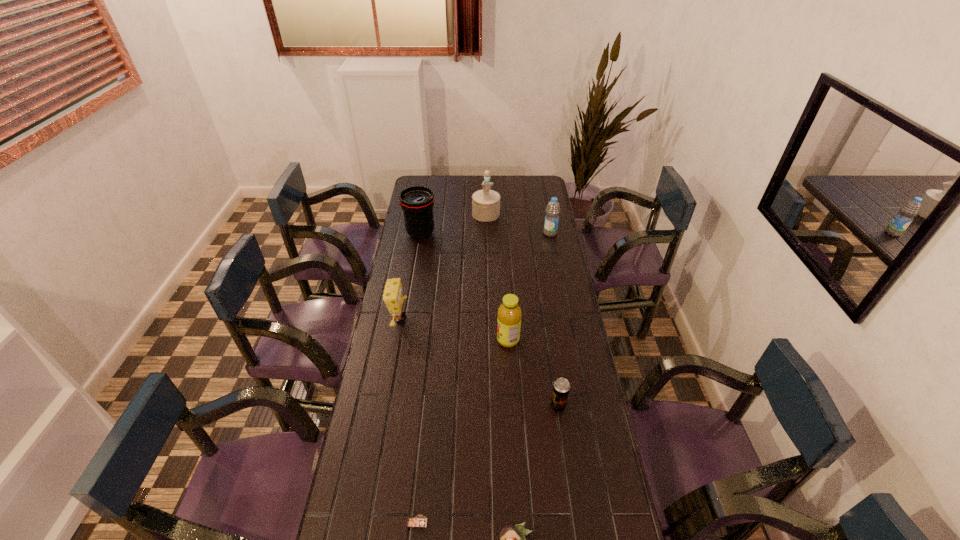
Where is `the farthest object`? the farthest object is located at coordinates (485, 203).

Locate an element on the screen. This screenshot has height=540, width=960. telephoto lens is located at coordinates (417, 202).

Identify the location of fruit juice. This screenshot has height=540, width=960. (509, 314).

Where is `water bottle`? water bottle is located at coordinates (550, 228).

Locate an element on the screen. The image size is (960, 540). the fifth tallest object is located at coordinates (393, 297).

Find the location of a particular element. the third nearest object is located at coordinates (561, 387).

Find the location of a particular element. the second object from right to left is located at coordinates [x=561, y=387].

The image size is (960, 540). In order to click on the second nearest object in this screenshot , I will do `click(417, 521)`.

At what (x,y) coordinates should I click in order to perform the action: click on the sixth object from right to left. Please return your answer as a coordinate pair (x, y). Looking at the image, I should click on [417, 521].

This screenshot has width=960, height=540. I want to click on vacant space located 0.200m at the beak of the farthest object, so click(x=487, y=245).